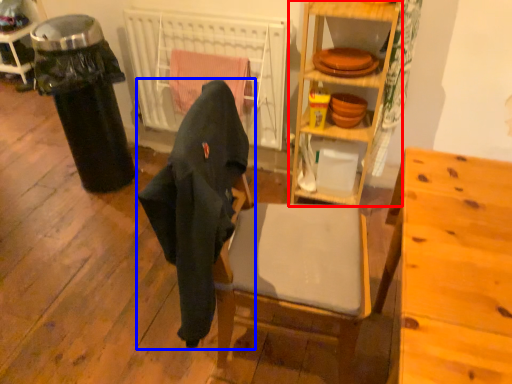
Question: Among these objects, which one is nearest to the camera, shelf (highlighted by a red box) or chair (highlighted by a blue box)?

Choices:
 (A) shelf
 (B) chair

Answer: (B)